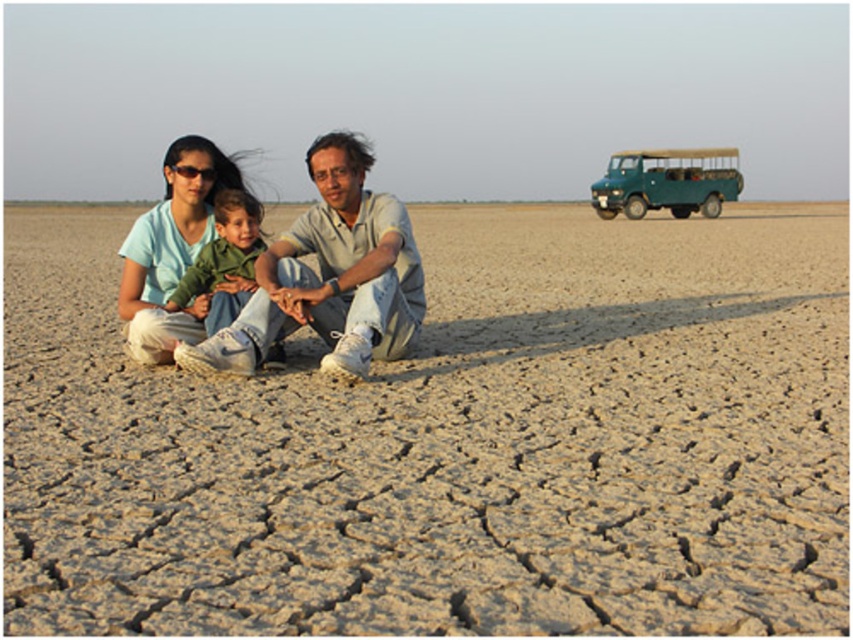
Does matte blue shirt at upper left appear under green cotton shirt at center?

No.

The image size is (853, 640). Identify the location of matte blue shirt at upper left. (171, 250).

Is point (207, 209) in front of point (252, 205)?

No, (207, 209) is behind (252, 205).

At what (x,y) coordinates should I click in order to perform the action: click on matte blue shirt at upper left. Please return your answer as a coordinate pair (x, y). Looking at the image, I should click on (171, 250).

Who is more distant from viewer, (x=404, y=234) or (x=231, y=189)?

The point (x=231, y=189) is more distant.

This screenshot has width=853, height=640. What do you see at coordinates (341, 268) in the screenshot?
I see `light beige cotton shirt at center` at bounding box center [341, 268].

The width and height of the screenshot is (853, 640). In order to click on light beige cotton shirt at center in this screenshot , I will do `click(341, 268)`.

Between dried mud at center and matte blue shirt at upper left, which one has less height?

Standing shorter between the two is matte blue shirt at upper left.

Is dried mud at center to the left of matte blue shirt at upper left from the viewer's perspective?

Correct, you'll find dried mud at center to the left of matte blue shirt at upper left.

Which is behind, point (465, 380) or point (160, 244)?

The point (160, 244) is behind.

Locate an element on the screen. The width and height of the screenshot is (853, 640). dried mud at center is located at coordinates click(450, 442).